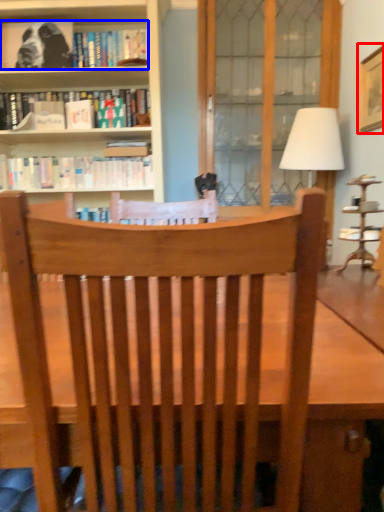
Question: Which of the following is the closest to the observer, picture frame (highlighted by a red box) or book (highlighted by a blue box)?

Choices:
 (A) picture frame
 (B) book

Answer: (A)